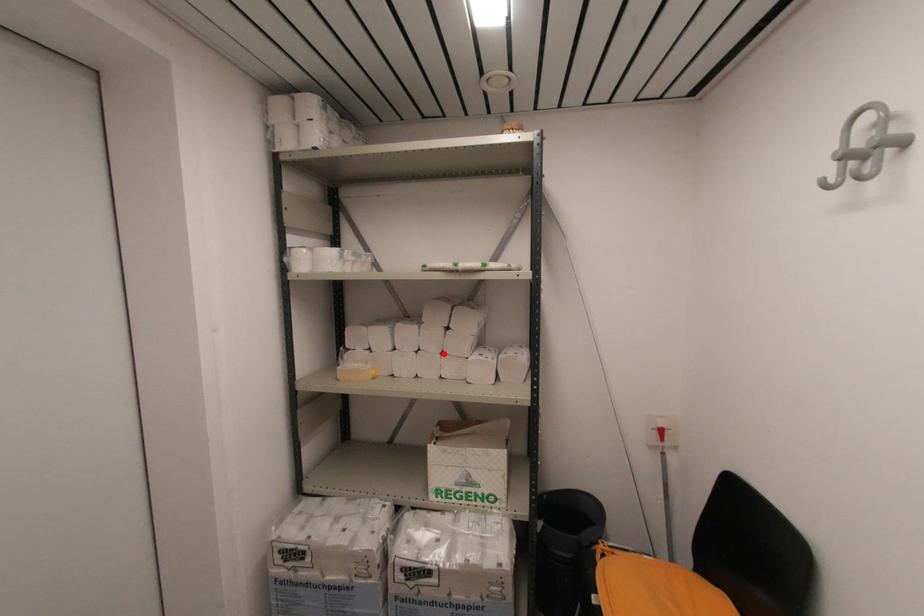
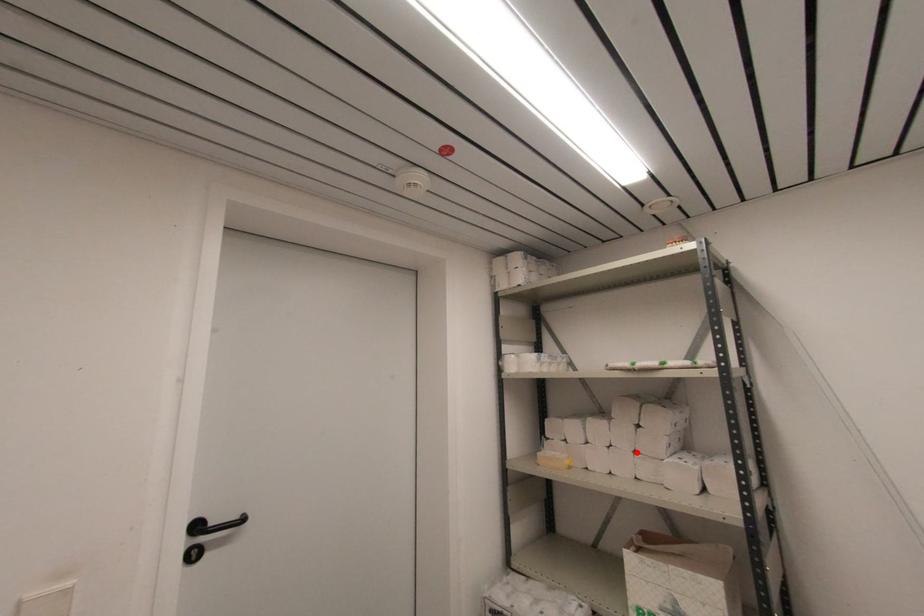
I am providing you with two images of the same scene from different viewpoints. A red point is marked on the first image and another point is marked on the second image. Is the marked point in image1 the same physical position as the marked point in image2?

Yes